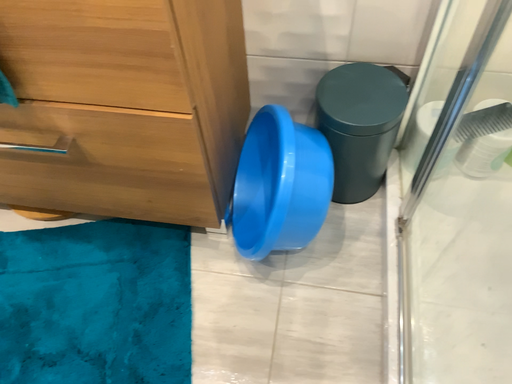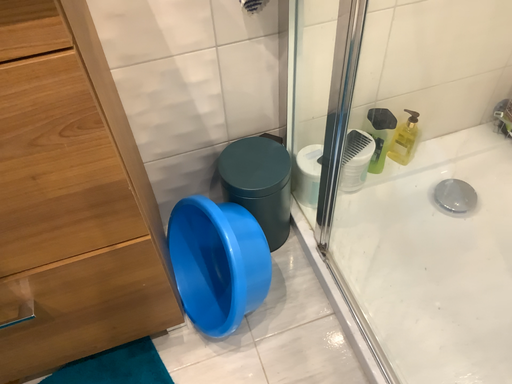
Question: How did the camera likely rotate when shooting the video?

Choices:
 (A) rotated left
 (B) rotated right

Answer: (B)